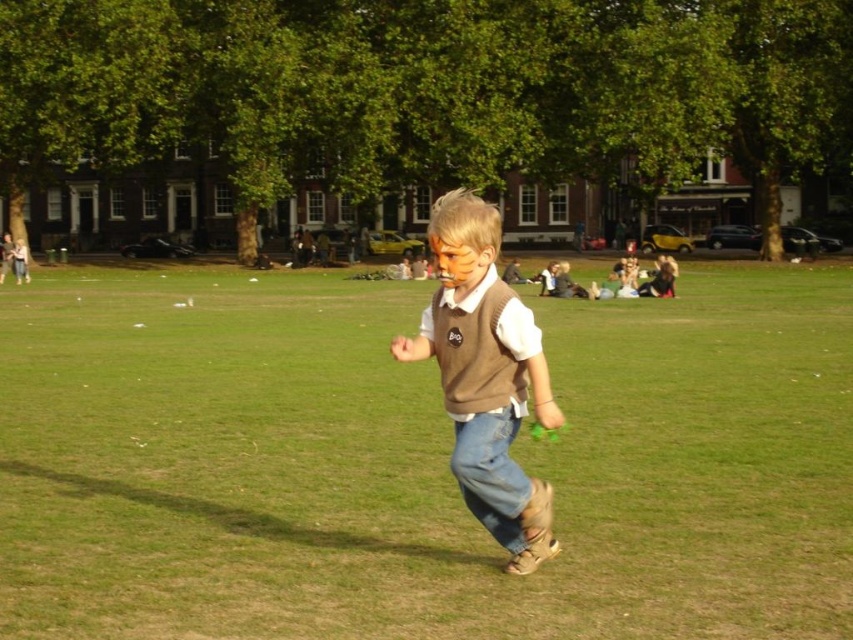
Can you confirm if brown leather shoes at center is positioned to the right of denim jeans at center?

No, brown leather shoes at center is not to the right of denim jeans at center.

Identify the location of brown leather shoes at center. (416, 461).

At what (x,y) coordinates should I click in order to perform the action: click on brown leather shoes at center. Please return your answer as a coordinate pair (x, y). The width and height of the screenshot is (853, 640). Looking at the image, I should click on (416, 461).

Is point (498, 397) closer to viewer compared to point (479, 416)?

No, (498, 397) is further to viewer.

This screenshot has width=853, height=640. What do you see at coordinates (486, 376) in the screenshot?
I see `brown suede vest at center` at bounding box center [486, 376].

Is point (509, 333) positioned before point (492, 484)?

That is True.

I want to click on brown suede vest at center, so click(486, 376).

Consider the image. Who is lower down, brown leather shoes at center or brown suede vest at center?

brown suede vest at center is below.

Does brown leather shoes at center come in front of brown suede vest at center?

Yes, it is in front of brown suede vest at center.

Who is more forward, (241, 586) or (534, 346)?

Point (534, 346)

Where is `brown leather shoes at center`? brown leather shoes at center is located at coordinates (416, 461).